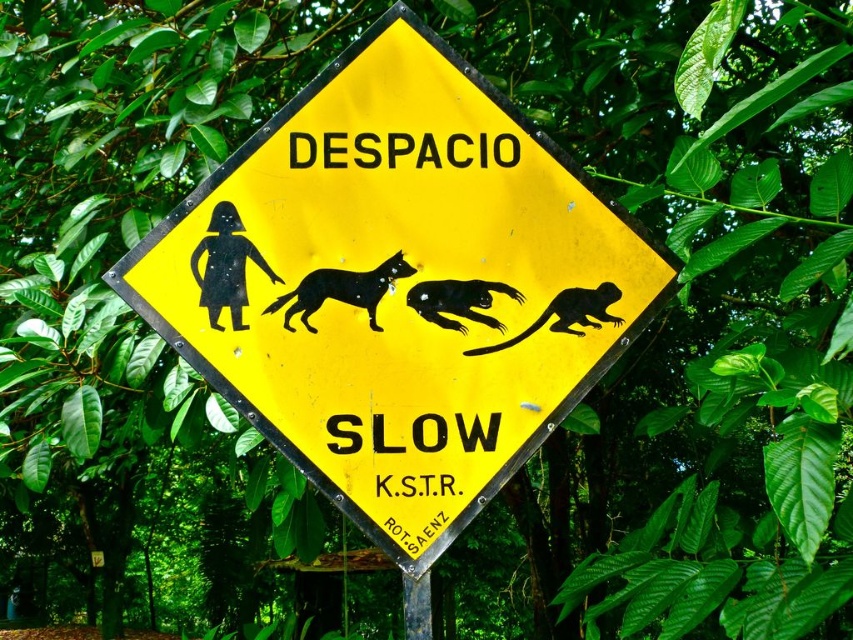
Is point (326, 288) positioned before point (439, 292)?

Yes.

This screenshot has height=640, width=853. Describe the element at coordinates (341, 291) in the screenshot. I see `black glossy dog at center` at that location.

Locate an element on the screen. Image resolution: width=853 pixels, height=640 pixels. black glossy dog at center is located at coordinates (341, 291).

At what (x,y) coordinates should I click in order to perform the action: click on yellow plastic sign at center. Please return your answer as a coordinate pair (x, y). Looking at the image, I should click on (393, 284).

Looking at this image, how distant is yellow plastic sign at center from black glossy dog at center?

yellow plastic sign at center is 5.46 inches away from black glossy dog at center.

You are a GUI agent. You are given a task and a screenshot of the screen. Output one action in this format:
    pyautogui.click(x=<x>, y=<y>)
    Task: Click on the yellow plastic sign at center
    The image size is (853, 640).
    Given the screenshot: What is the action you would take?
    pyautogui.click(x=393, y=284)

Who is positioned more to the left, yellow plastic sign at center or silhouette glossy monkey at center?

Positioned to the left is yellow plastic sign at center.

In the scene shown: Is yellow plastic sign at center bigger than silhouette glossy monkey at center?

Indeed, yellow plastic sign at center has a larger size compared to silhouette glossy monkey at center.

Who is more distant from viewer, (399, 141) or (590, 308)?

The point (399, 141) is behind.

Find the location of `yellow plastic sign at center`. yellow plastic sign at center is located at coordinates (393, 284).